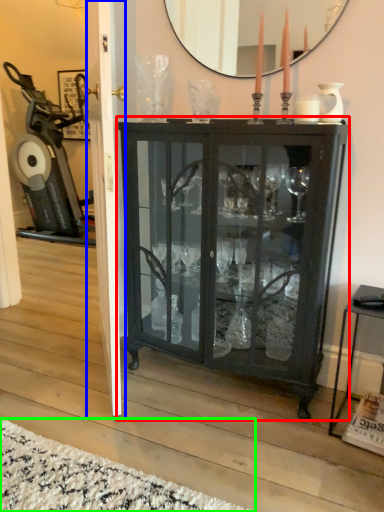
Question: Considering the real-world distances, which object is farthest from cupboard (highlighted by a red box)? screen door (highlighted by a blue box) or plain (highlighted by a green box)?

Choices:
 (A) screen door
 (B) plain

Answer: (B)